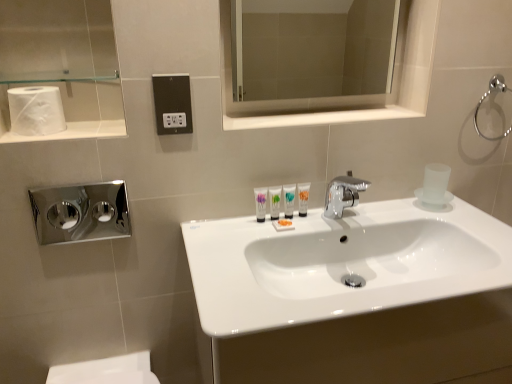
In order to click on vacant space in front of translucent plastic mouthwash at center, the 2th mouthwash positioned from the left in this screenshot , I will do point(286,233).